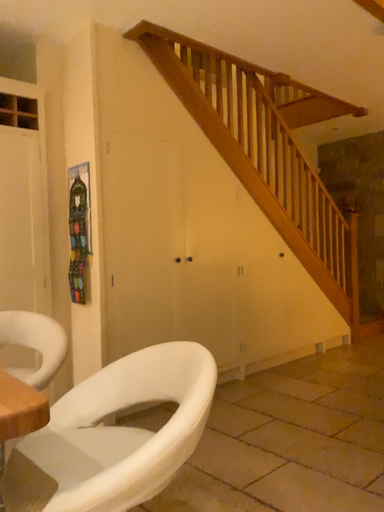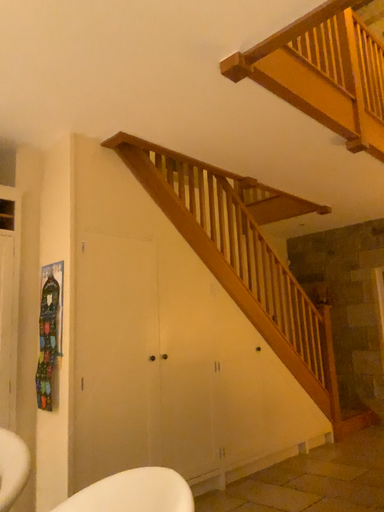
Question: How did the camera likely rotate when shooting the video?

Choices:
 (A) rotated downward
 (B) rotated upward

Answer: (B)